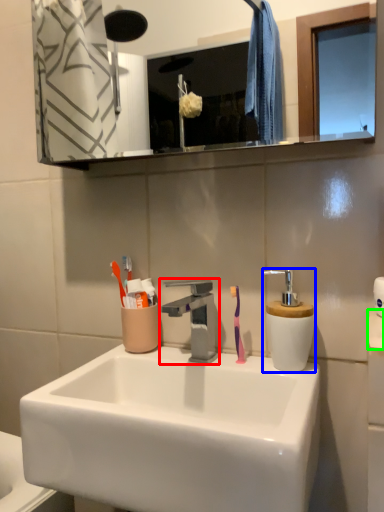
Question: Considering the real-world distances, which object is farthest from tap (highlighted by a red box)? soap dispenser (highlighted by a blue box) or toilet paper (highlighted by a green box)?

Choices:
 (A) soap dispenser
 (B) toilet paper

Answer: (B)